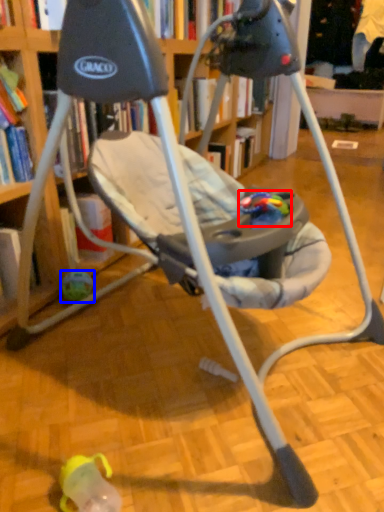
Question: Which object is closer to the camera taking this photo, toy (highlighted by a red box) or toy (highlighted by a blue box)?

Choices:
 (A) toy
 (B) toy

Answer: (A)